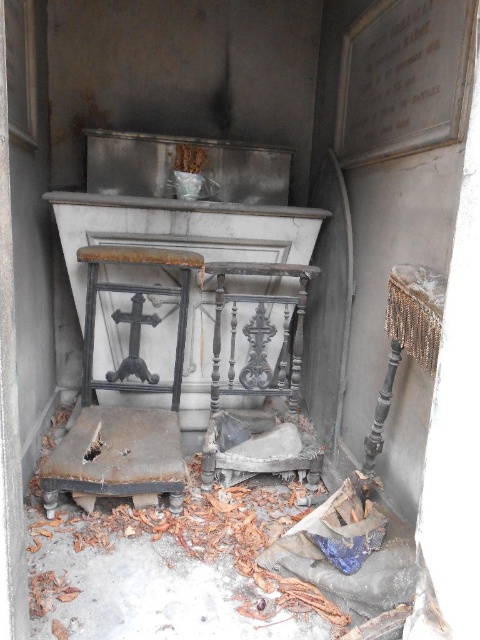
You are a maintenance worker who needs to move a 8 inch wide tool box through the space between the rusty metal table at center and the dark wood ornate chair at center. Can you fit the tool box through that space?

The rusty metal table at center and dark wood ornate chair at center are 7.80 inches apart from each other. Since the tool box is 8 inches wide, it cannot fit through the space between them.

You are a maintenance worker in a crypt. You need to move the dark wood ornate chair at center and the silver metallic stool at right to another room. Which object should you move first if you want to access the one below it?

The dark wood ornate chair at center is located above the silver metallic stool at right, so you should move the dark wood ornate chair at center first to access the silver metallic stool at right below it.